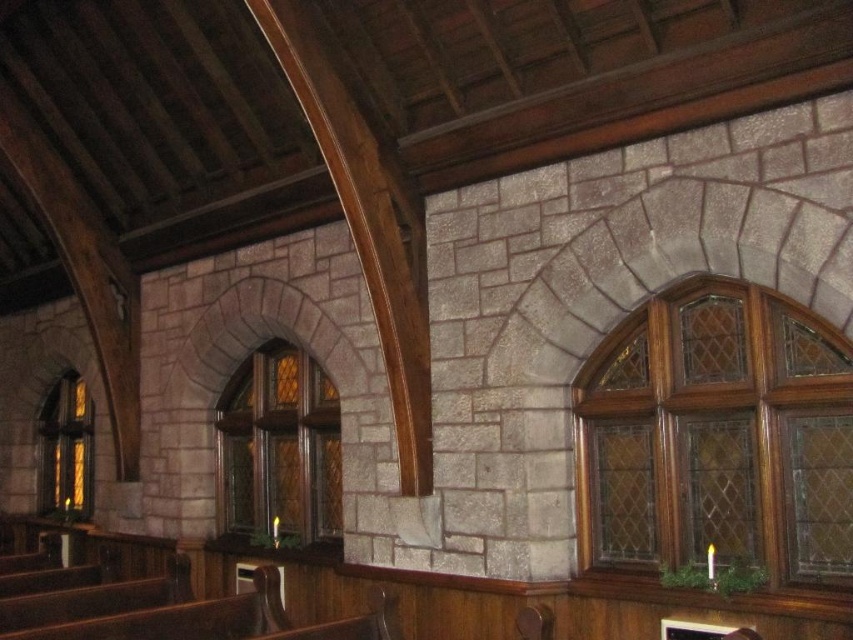
You are standing inside the church and want to take a photo of both stained glass windows. If you first take a photo of the stained glass window at left, which direction should you turn to capture the stained glass window at center in your next shot?

Since the stained glass window at center is to the right of the stained glass window at left, you should turn to your right to capture the stained glass window at center in your next shot.

You are standing inside a church with stone walls and arched windows. You notice a point marked at coordinates (717, 436). What does this point indicate?

The point at coordinates (717, 436) marks the location of the stained glass window at upper right.

You are standing inside the church and notice two points marked on the wall. The first point is at coordinates point (250, 412) and the second is at point (56, 401). Which point is nearer to your current position?

Point (250, 412) is closer to the viewer than point (56, 401).